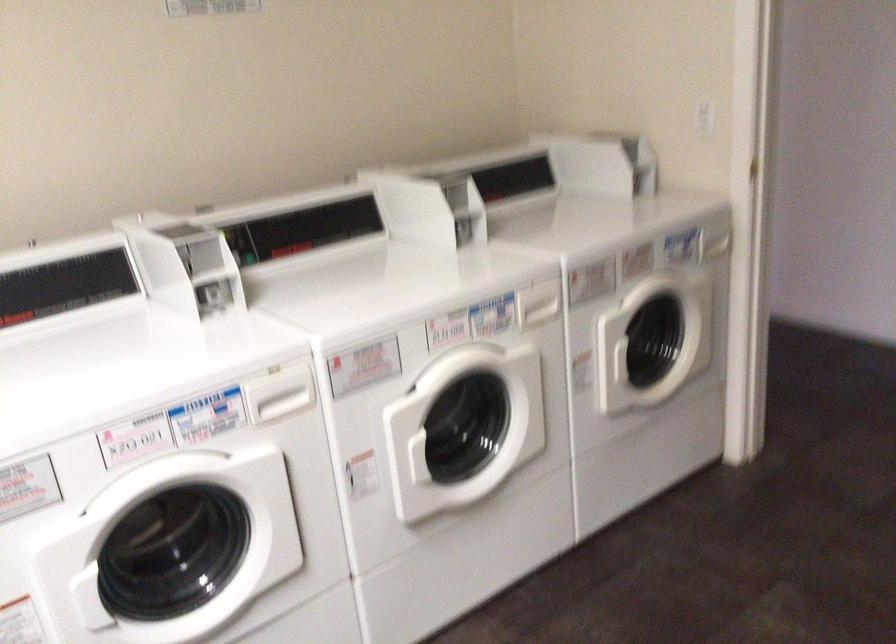
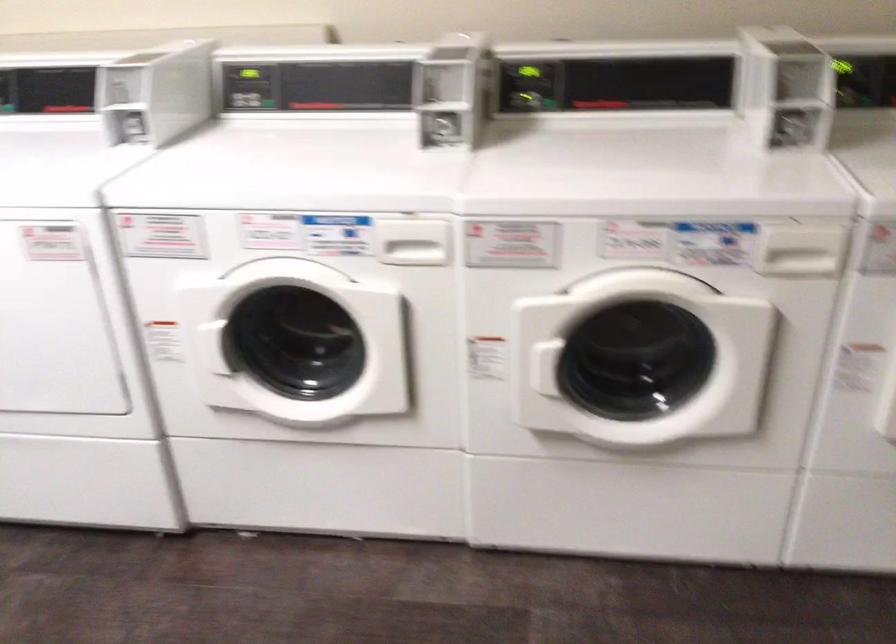
Where in the second image is the point corresponding to (204,299) from the first image?

(435, 129)